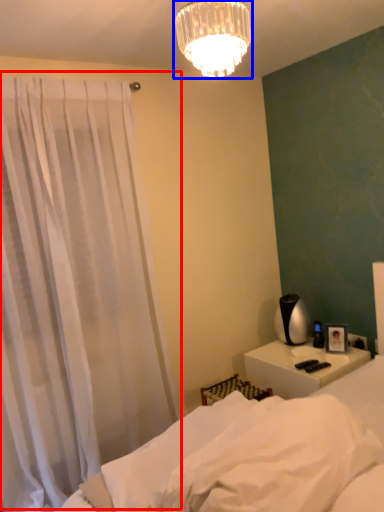
Question: Which point is closer to the camera, curtain (highlighted by a red box) or lamp (highlighted by a blue box)?

Choices:
 (A) curtain
 (B) lamp

Answer: (B)